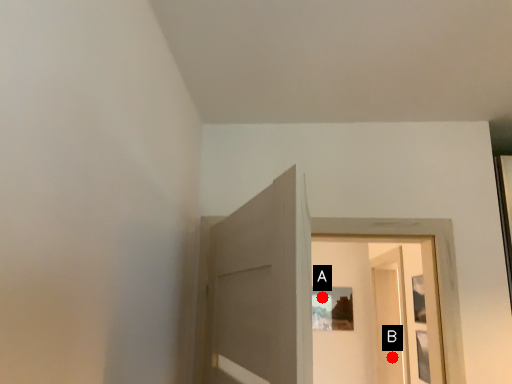
Question: Two points are circled on the image, labeled by A and B beside each circle. Which point is closer to the camera?

Choices:
 (A) A is closer
 (B) B is closer

Answer: (B)